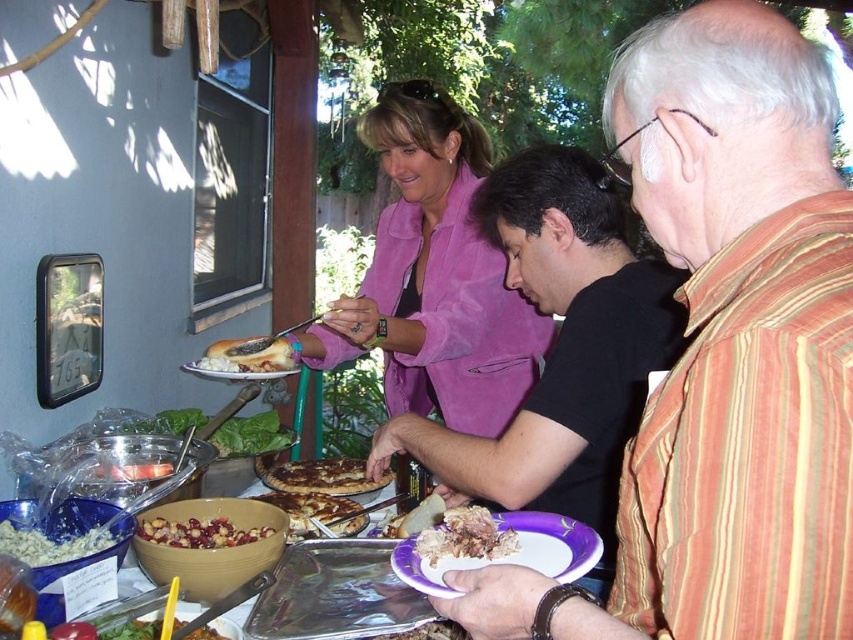
Question: Which of the following is the closest to the observer?

Choices:
 (A) slightly toasted bread at center
 (B) black matte shirt at center
 (C) chocolate glazed pastry at center

Answer: (B)

Question: Which object is positioned closest to the crumbly brown bread at center?

Choices:
 (A) chocolate glazed pastry at center
 (B) shiny brown bowl at lower left

Answer: (B)

Question: Does black matte shirt at center have a lesser width compared to shiny brown bowl at lower left?

Choices:
 (A) no
 (B) yes

Answer: (A)

Question: Is white plastic plate at lower center smaller than slightly toasted bread at center?

Choices:
 (A) yes
 (B) no

Answer: (A)

Question: Which is farther from the golden brown pancake at center?

Choices:
 (A) shiny red sauce at lower left
 (B) chocolate glazed pastry at center

Answer: (A)

Question: Where is crumbly brown bread at center located in relation to shiny red sauce at lower left in the image?

Choices:
 (A) right
 (B) left

Answer: (A)